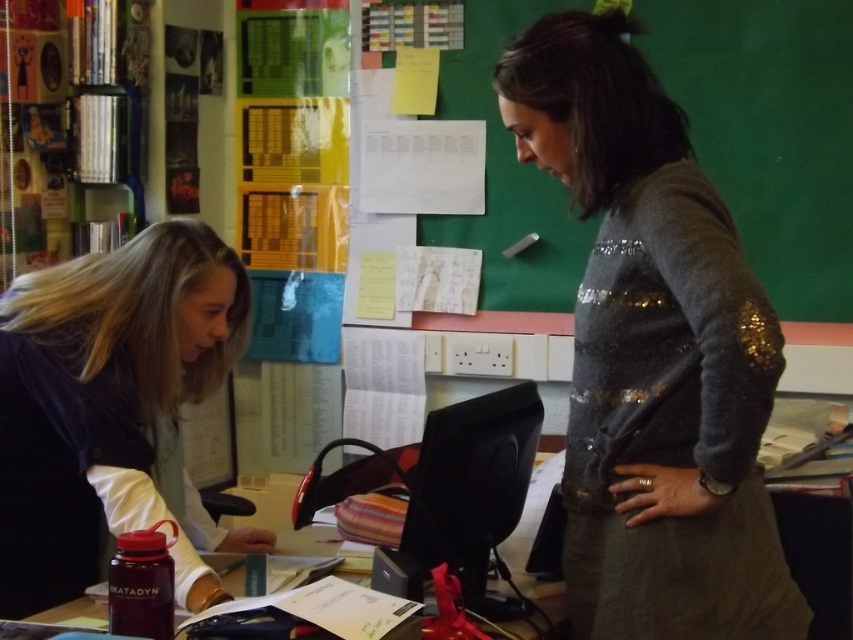
Who is taller, black glossy monitor at center or translucent plastic water bottle at lower left?

With more height is black glossy monitor at center.

Does black glossy monitor at center have a greater width compared to translucent plastic water bottle at lower left?

Indeed, black glossy monitor at center has a greater width compared to translucent plastic water bottle at lower left.

Is point (526, 486) more distant than point (503, 627)?

Yes, point (526, 486) is farther from viewer.

Find the location of a particular element. The image size is (853, 640). black glossy monitor at center is located at coordinates (473, 490).

Is sparkly gray sweater at right above matte black jacket at left?

Yes, sparkly gray sweater at right is above matte black jacket at left.

Where is `sparkly gray sweater at right`? sparkly gray sweater at right is located at coordinates [653, 355].

This screenshot has width=853, height=640. What do you see at coordinates (653, 355) in the screenshot?
I see `sparkly gray sweater at right` at bounding box center [653, 355].

The image size is (853, 640). In order to click on sparkly gray sweater at right in this screenshot , I will do click(x=653, y=355).

Who is higher up, matte black jacket at left or translucent plastic water bottle at lower left?

Positioned higher is matte black jacket at left.

Between matte black jacket at left and translucent plastic water bottle at lower left, which one has less height?

translucent plastic water bottle at lower left is shorter.

Who is more distant from viewer, (x=164, y=506) or (x=355, y=580)?

Positioned behind is point (x=355, y=580).

This screenshot has height=640, width=853. What are the coordinates of `matte black jacket at left` in the screenshot? It's located at (108, 400).